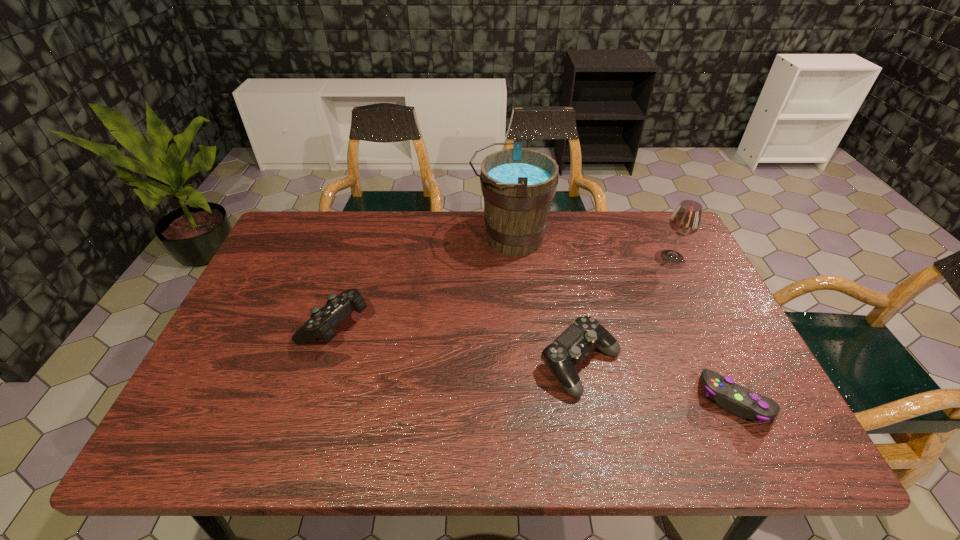
Identify the location of free region located on the right of the leftmost control. The width and height of the screenshot is (960, 540). (492, 325).

The image size is (960, 540). I want to click on vacant space situated on the left of the second control from right to left, so click(x=376, y=364).

Where is `free space located on the back of the rightmost control`? This screenshot has height=540, width=960. free space located on the back of the rightmost control is located at coordinates (692, 309).

The height and width of the screenshot is (540, 960). Identify the location of wine bucket at the far edge. (518, 185).

In order to click on wineglass that is positioned at the far edge in this screenshot , I will do `click(686, 220)`.

Locate an element on the screen. The width and height of the screenshot is (960, 540). object that is positioned at the near edge is located at coordinates (738, 400).

Locate an element on the screen. This screenshot has height=540, width=960. wineglass that is positioned at the right edge is located at coordinates tap(686, 220).

Find the location of a particular element. control present at the right edge is located at coordinates (738, 400).

Find the location of a particular element. object that is at the far right corner is located at coordinates (686, 220).

Find the location of a particular element. This screenshot has height=540, width=960. object present at the near right corner is located at coordinates (738, 400).